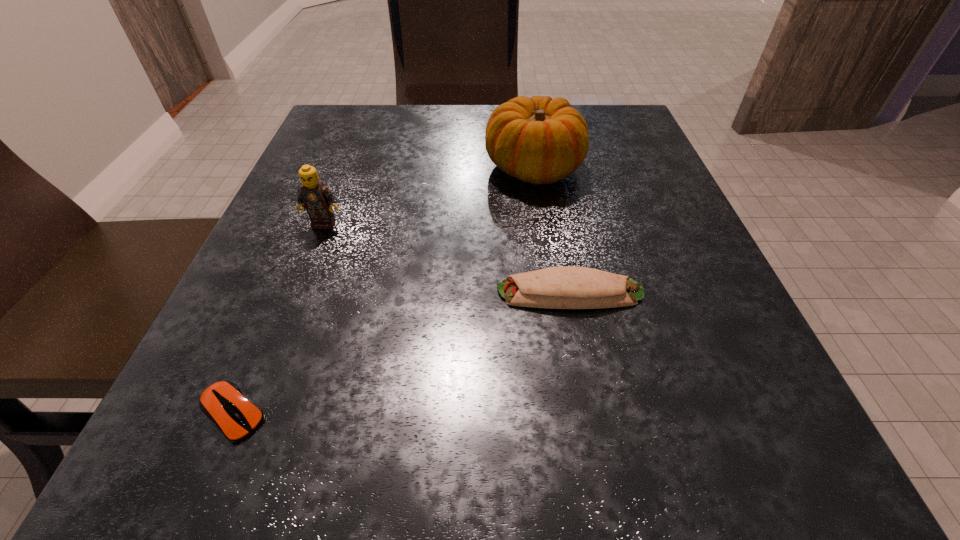
In order to click on free space between the farthest object and the shortest object in this screenshot , I will do `click(384, 291)`.

The width and height of the screenshot is (960, 540). Identify the location of vacant space that is in between the nearest object and the third tallest object. (401, 353).

Locate an element on the screen. This screenshot has height=540, width=960. free area in between the second shortest object and the farthest object is located at coordinates (552, 230).

At what (x,y) coordinates should I click in order to perform the action: click on free space between the second farthest object and the gourd. Please return your answer as a coordinate pair (x, y). The image size is (960, 540). Looking at the image, I should click on (429, 196).

This screenshot has height=540, width=960. Identify the location of vacant region between the shortest object and the third farthest object. (401, 353).

Where is `empty space that is in between the gourd and the third tallest object`? The image size is (960, 540). empty space that is in between the gourd and the third tallest object is located at coordinates (552, 230).

Locate an element on the screen. The width and height of the screenshot is (960, 540). vacant point located between the gourd and the third tallest object is located at coordinates (552, 230).

The height and width of the screenshot is (540, 960). I want to click on vacant region between the second nearest object and the second farthest object, so click(446, 258).

Locate which object ranks third in proximity to the computer mouse. Please provide its 2D coordinates. Your answer should be formatted as a tuple, i.e. [(x, y)], where the tuple contains the x and y coordinates of a point satisfying the conditions above.

[(539, 140)]

Identify which object is the nearest to the burrito. Please provide its 2D coordinates. Your answer should be formatted as a tuple, i.e. [(x, y)], where the tuple contains the x and y coordinates of a point satisfying the conditions above.

[(539, 140)]